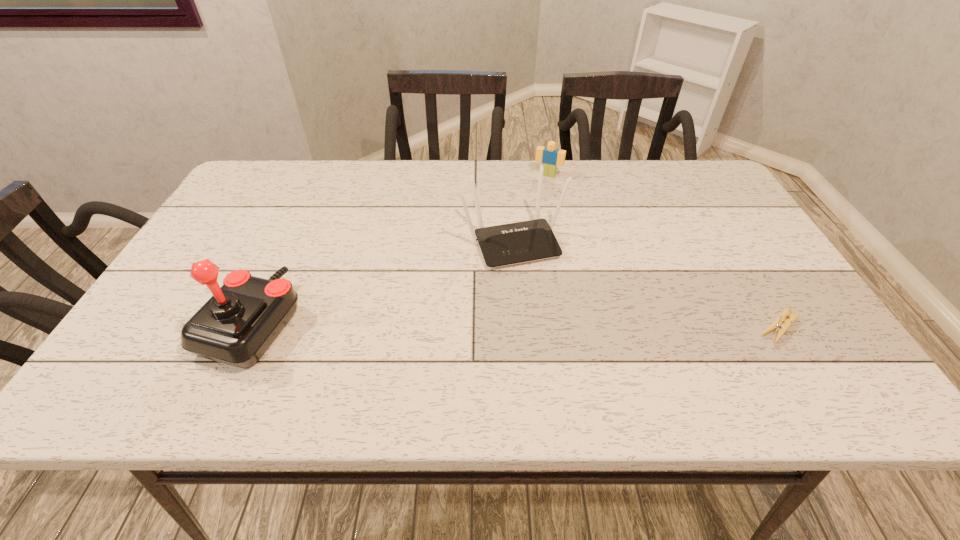
What are the coordinates of `the leftmost object` in the screenshot? It's located at (236, 326).

You are a GUI agent. You are given a task and a screenshot of the screen. Output one action in this format:
    pyautogui.click(x=<x>, y=<y>)
    Task: Click on the joystick
    The width and height of the screenshot is (960, 540).
    Given the screenshot: What is the action you would take?
    pyautogui.click(x=236, y=326)

Locate an element on the screen. the shortest object is located at coordinates click(776, 326).

I want to click on the rightmost object, so click(776, 326).

Locate an element on the screen. the second tallest object is located at coordinates (508, 244).

Find the location of `the third nearest object`. the third nearest object is located at coordinates (508, 244).

The image size is (960, 540). I want to click on Lego, so click(x=550, y=157).

The image size is (960, 540). Identify the location of the third tallest object. (550, 157).

The image size is (960, 540). I want to click on vacant area located 0.110m on the left of the tallest object, so click(x=157, y=323).

Where is `free region located on the left of the clothespin`? This screenshot has width=960, height=540. free region located on the left of the clothespin is located at coordinates click(x=691, y=327).